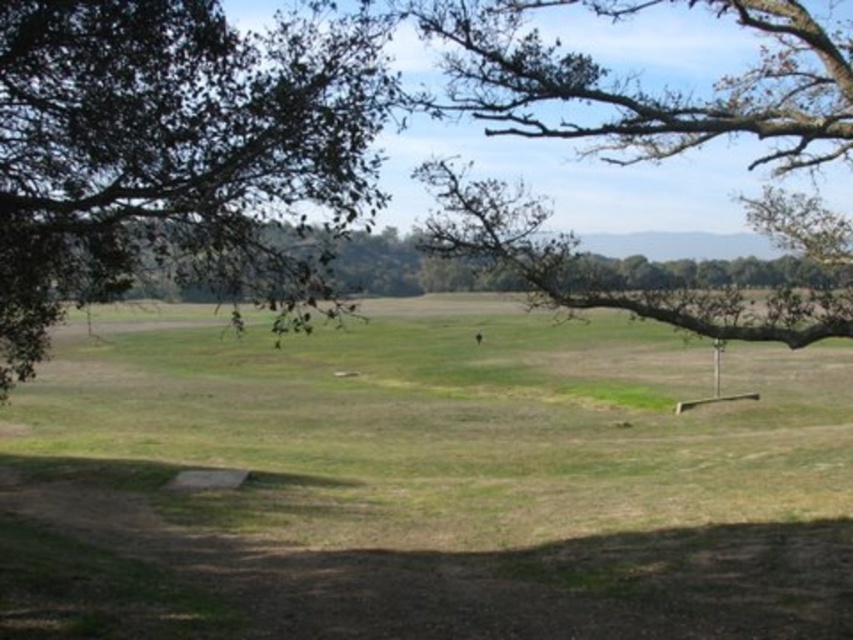
Question: Which point appears closest to the camera in this image?

Choices:
 (A) (103, 116)
 (B) (706, 129)

Answer: (A)

Question: Is green leafy tree at upper left bigger than brown textured branch at upper right?

Choices:
 (A) yes
 (B) no

Answer: (B)

Question: Which point is farther from the camera taking this photo?

Choices:
 (A) (729, 100)
 (B) (341, 164)

Answer: (A)

Question: Can you confirm if green leafy tree at upper left is wider than brown textured branch at upper right?

Choices:
 (A) no
 (B) yes

Answer: (A)

Question: Does green leafy tree at upper left appear over brown textured branch at upper right?

Choices:
 (A) yes
 (B) no

Answer: (B)